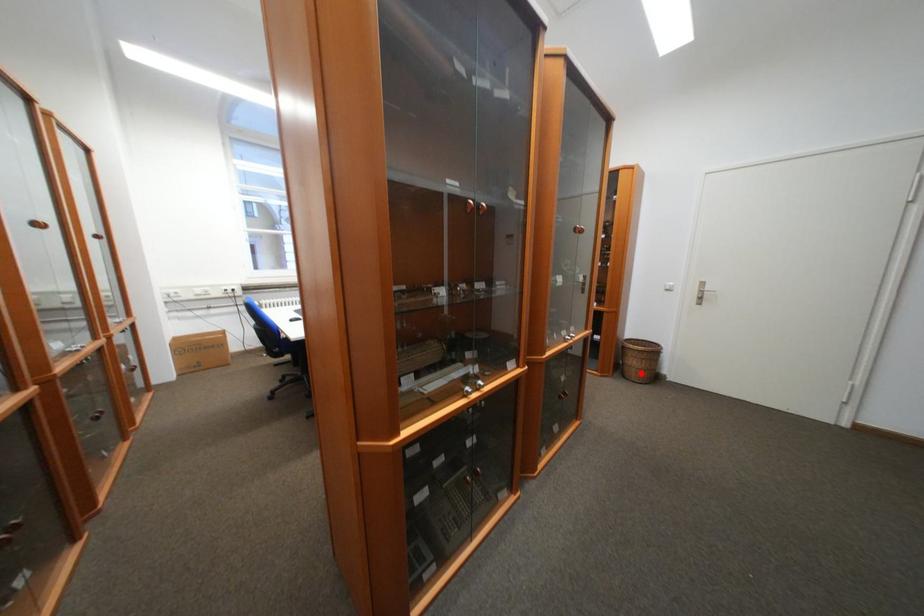
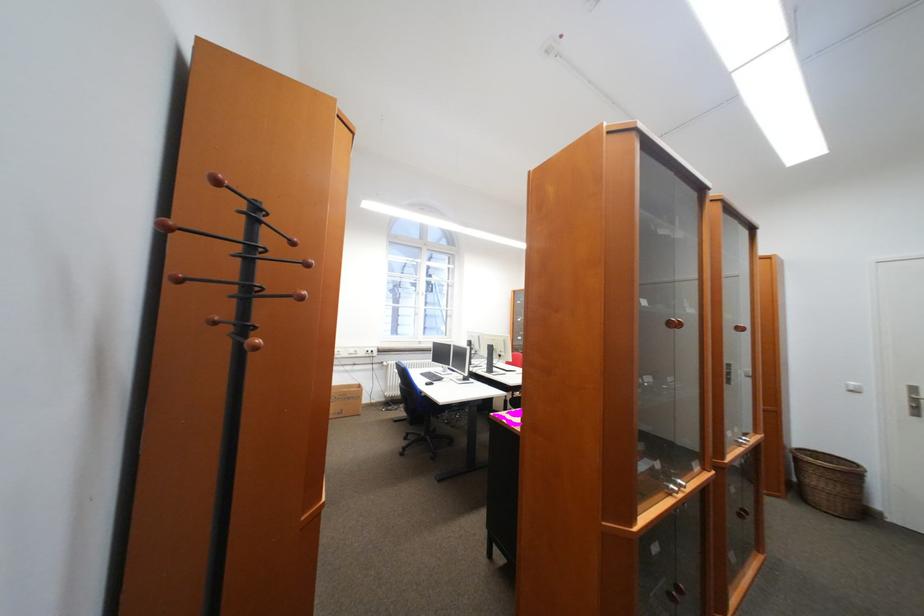
Question: I am providing you with two images of the same scene from different viewpoints. Given a red point in image1, look at the same physical point in image2. Is it:

Choices:
 (A) Closer to the viewpoint
 (B) Farther from the viewpoint

Answer: (B)